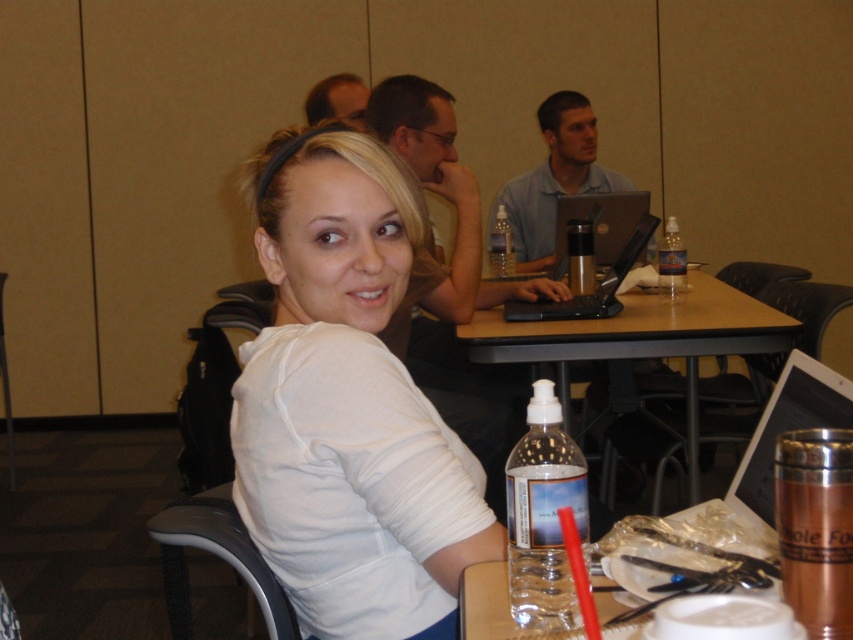
You are organizing the items on the table and need to place the clear plastic bottle at table right and the clear plastic bottle at center in a specific order. Which bottle is located to the right of the other?

The clear plastic bottle at table right is positioned on the right side of clear plastic bottle at center.

You are a photographer setting up for a group photo in this conference room. You need to position your camera so that both the white matte shirt at center and the metallic gray chair at left are visible in the frame. Based on their positions, which object should be placed closer to the left side of the camera frame?

The metallic gray chair at left should be placed closer to the left side of the camera frame because the white matte shirt at center is to the right of the metallic gray chair at left.